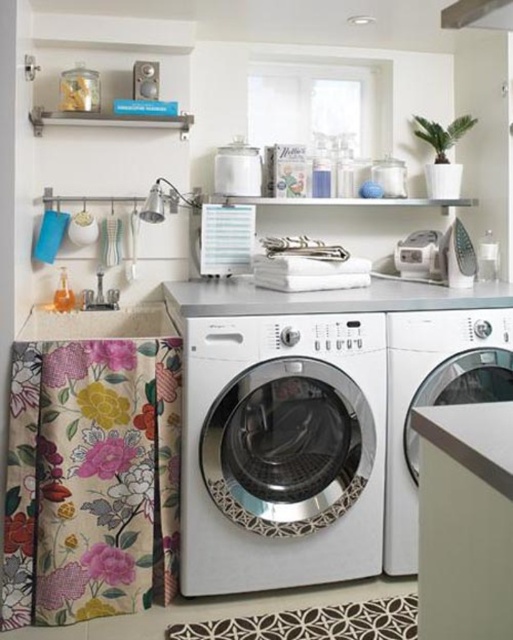
Is satin silver washing machine at center to the right of floral fabric laundry at left from the viewer's perspective?

Correct, you'll find satin silver washing machine at center to the right of floral fabric laundry at left.

Does satin silver washing machine at center have a lesser height compared to floral fabric laundry at left?

Incorrect, satin silver washing machine at center's height does not fall short of floral fabric laundry at left's.

This screenshot has width=513, height=640. Identify the location of satin silver washing machine at center. (312, 422).

Does satin silver washing machine at center appear over satin white washing machine at center?

Yes, satin silver washing machine at center is above satin white washing machine at center.

Looking at this image, between satin silver washing machine at center and satin white washing machine at center, which one is positioned lower?

satin white washing machine at center is lower down.

Where is `satin silver washing machine at center`? satin silver washing machine at center is located at coordinates (312, 422).

Looking at this image, does floral fabric laundry at left lie behind satin white washing machine at center?

No, it is not.

Who is more distant from viewer, (32, 541) or (450, 321)?

Point (450, 321)

Identify the location of floral fabric laundry at left. Image resolution: width=513 pixels, height=640 pixels. (90, 480).

Locate an element on the screen. The width and height of the screenshot is (513, 640). floral fabric laundry at left is located at coordinates tap(90, 480).